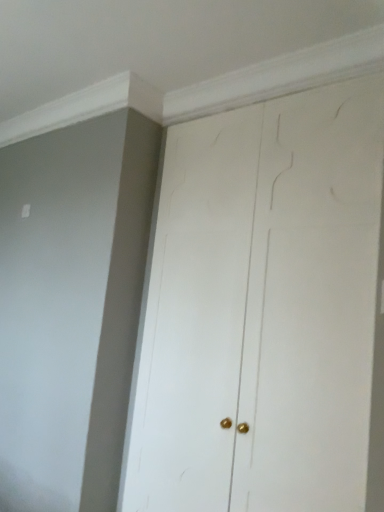
I want to click on white matte door at center, so pyautogui.click(x=263, y=309).

The height and width of the screenshot is (512, 384). Describe the element at coordinates (263, 309) in the screenshot. I see `white matte door at center` at that location.

Where is `white matte door at center`? Image resolution: width=384 pixels, height=512 pixels. white matte door at center is located at coordinates (263, 309).